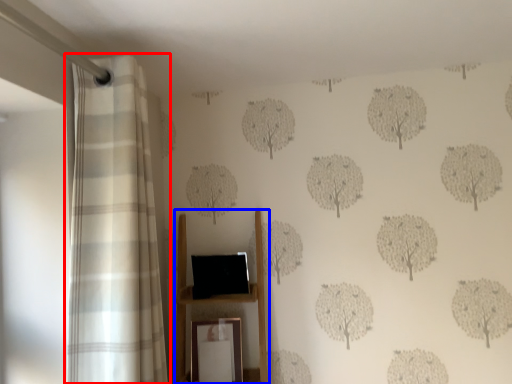
Question: Which of the following is the closest to the observer, curtain (highlighted by a red box) or furniture (highlighted by a blue box)?

Choices:
 (A) curtain
 (B) furniture

Answer: (A)